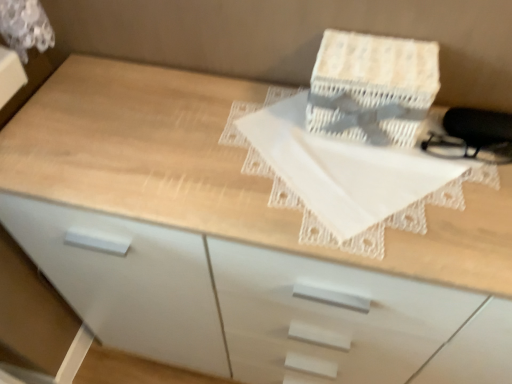
Question: From the image's perspective, relative to white lace cloth at center, is white woven cardboard box at upper center above or below?

Choices:
 (A) below
 (B) above

Answer: (B)

Question: From their relative heights in the image, would you say white woven cardboard box at upper center is taller or shorter than white lace cloth at center?

Choices:
 (A) tall
 (B) short

Answer: (A)

Question: Is white woven cardboard box at upper center bigger or smaller than white lace cloth at center?

Choices:
 (A) small
 (B) big

Answer: (B)

Question: Based on their positions, is white lace cloth at center located to the left or right of white woven cardboard box at upper center?

Choices:
 (A) right
 (B) left

Answer: (B)

Question: In terms of size, does white lace cloth at center appear bigger or smaller than white woven cardboard box at upper center?

Choices:
 (A) small
 (B) big

Answer: (A)

Question: In terms of height, does white lace cloth at center look taller or shorter compared to white woven cardboard box at upper center?

Choices:
 (A) tall
 (B) short

Answer: (B)

Question: Is white lace cloth at center wider or thinner than white woven cardboard box at upper center?

Choices:
 (A) wide
 (B) thin

Answer: (A)